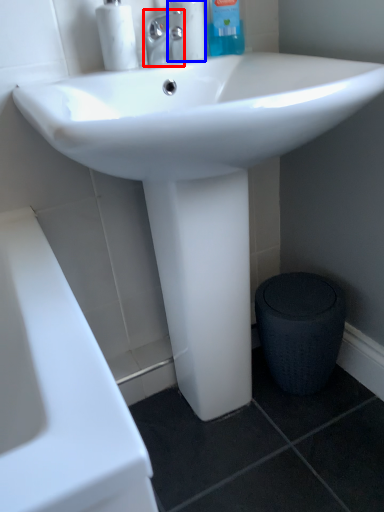
Question: Which point is closer to the camera, tap (highlighted by a red box) or cleaning product (highlighted by a blue box)?

Choices:
 (A) tap
 (B) cleaning product

Answer: (A)